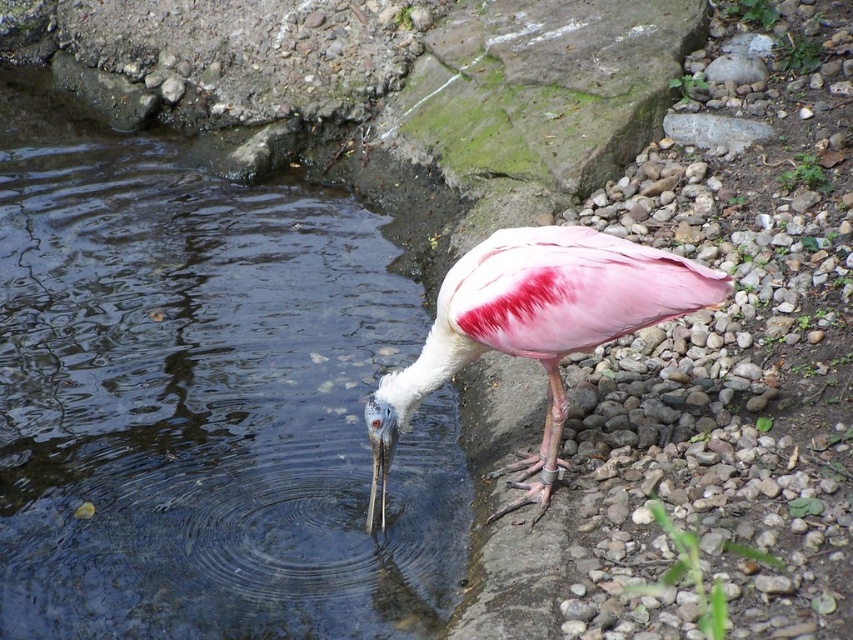
Consider the image. You are a photographer aiming to capture the pink feathered bird at center and the clear water at center in the same frame. Based on their positions, which object is closer to you?

The clear water at center is closer to you because the pink feathered bird at center is positioned behind it.

From the picture: You are a wildlife photographer trying to capture the pink feathered bird at center. You notice there is clear water at center in the image. Can the bird fit entirely within the clear water area without any part of its body extending beyond the water?

The clear water at center has a larger width than the pink feathered bird at center, so yes, the bird can fit entirely within the clear water area without any part of its body extending beyond the water.